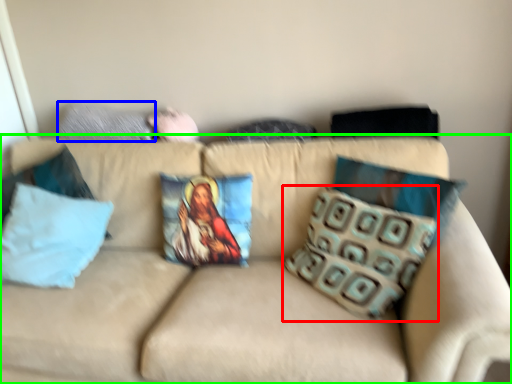
Question: Which object is the closest to the pillow (highlighted by a red box)? Choose among these: pillow (highlighted by a blue box) or studio couch (highlighted by a green box).

Choices:
 (A) pillow
 (B) studio couch

Answer: (B)